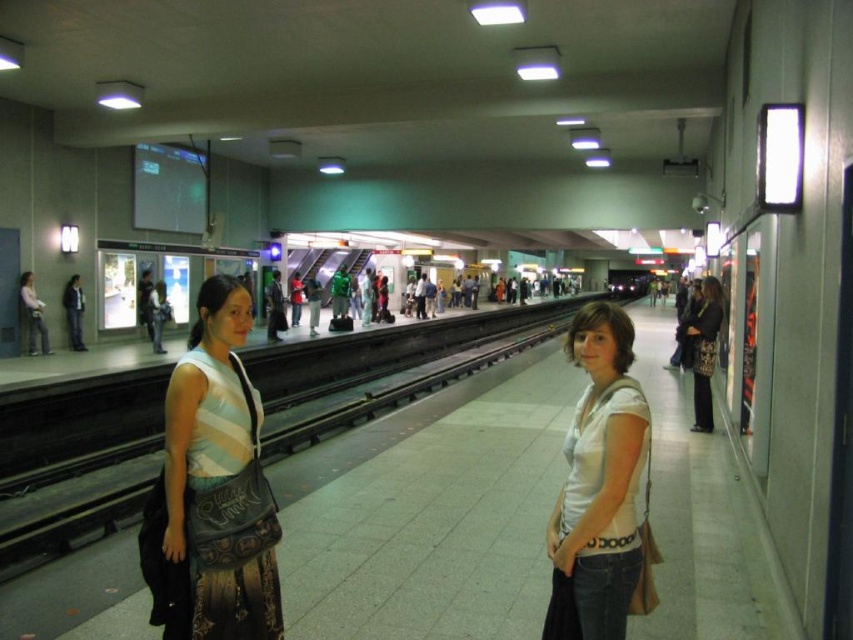
Does matte black bag at left appear over matte black jacket at center?

Actually, matte black bag at left is below matte black jacket at center.

Can you confirm if matte black bag at left is shorter than matte black jacket at center?

Indeed, matte black bag at left has a lesser height compared to matte black jacket at center.

You are a GUI agent. You are given a task and a screenshot of the screen. Output one action in this format:
    pyautogui.click(x=<x>, y=<y>)
    Task: Click on the matte black bag at left
    The image size is (853, 640).
    Given the screenshot: What is the action you would take?
    tap(218, 481)

Based on the photo, which is more to the left, matte black bag at left or white cotton shirt at center?

Positioned to the left is matte black bag at left.

Is point (195, 497) farther from camera compared to point (602, 632)?

Yes.

Who is more distant from viewer, [198,348] or [589,472]?

Point [198,348]

Where is `matte black bag at left`? The height and width of the screenshot is (640, 853). matte black bag at left is located at coordinates (218, 481).

Measure the distance between white cotton shirt at center and matte black jacket at center.

white cotton shirt at center and matte black jacket at center are 6.41 meters apart.

Is point (630, 582) farther from viewer compared to point (701, 280)?

No, (630, 582) is in front of (701, 280).

Image resolution: width=853 pixels, height=640 pixels. What do you see at coordinates (601, 474) in the screenshot?
I see `white cotton shirt at center` at bounding box center [601, 474].

Identify the location of white cotton shirt at center. This screenshot has width=853, height=640. (601, 474).